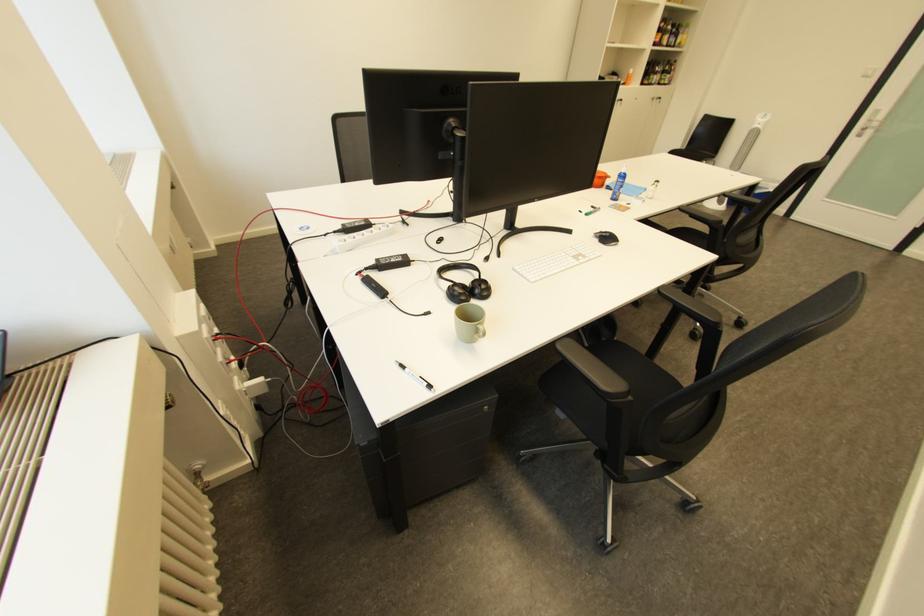
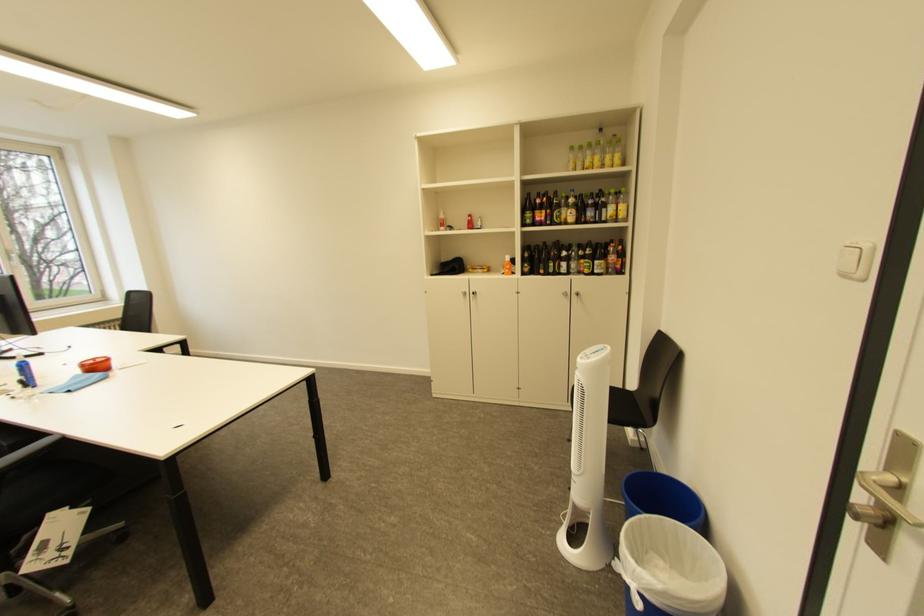
In the second image, find the point that corresponds to (x=776, y=188) in the first image.

(636, 570)